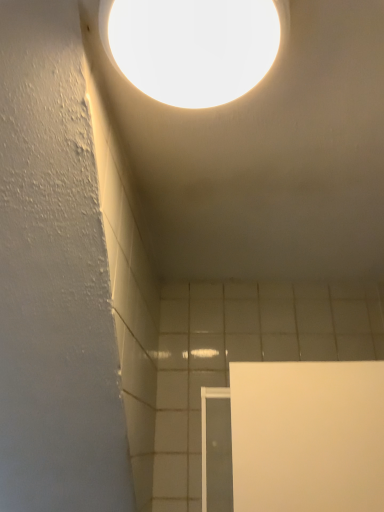
At what (x,y) coordinates should I click in order to perform the action: click on matte white light fixture at upper center. Please return your answer as a coordinate pair (x, y). This screenshot has height=512, width=384. Looking at the image, I should click on (193, 47).

Image resolution: width=384 pixels, height=512 pixels. What do you see at coordinates (193, 47) in the screenshot? I see `matte white light fixture at upper center` at bounding box center [193, 47].

Image resolution: width=384 pixels, height=512 pixels. I want to click on matte white light fixture at upper center, so click(193, 47).